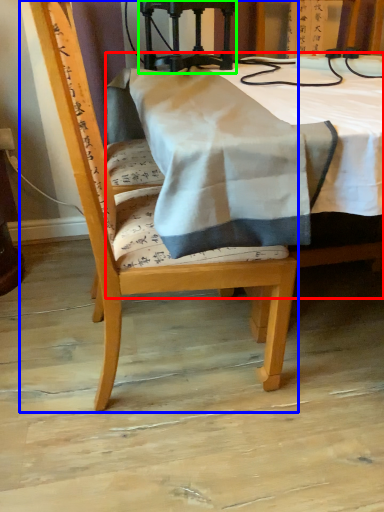
Question: Which object is positioned farthest from table (highlighted by a red box)? Select from chair (highlighted by a blue box) and equipment (highlighted by a green box).

Choices:
 (A) chair
 (B) equipment

Answer: (A)